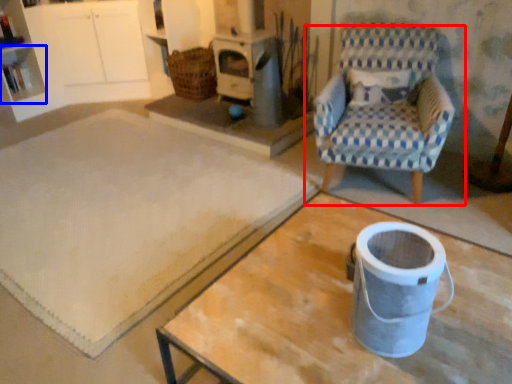
Question: Among these objects, which one is farthest to the camera, chair (highlighted by a red box) or shelf (highlighted by a blue box)?

Choices:
 (A) chair
 (B) shelf

Answer: (B)